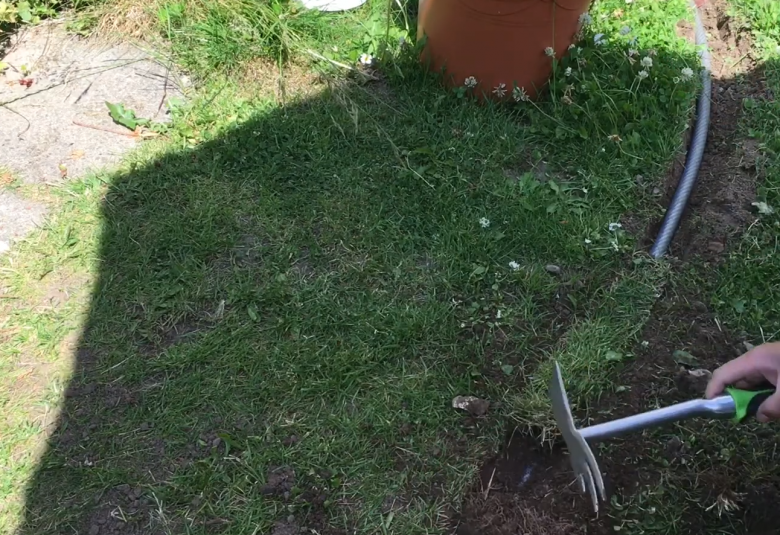
Locate an element on the screen. orange plant pot is located at coordinates (487, 63).